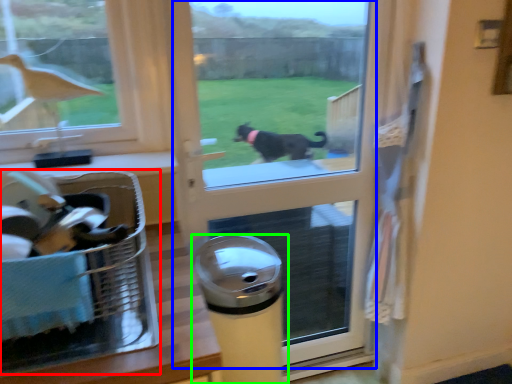
Question: Which object is the farthest from laundry basket (highlighted by a red box)? Choose among these: screen door (highlighted by a blue box) or waste container (highlighted by a green box).

Choices:
 (A) screen door
 (B) waste container

Answer: (A)